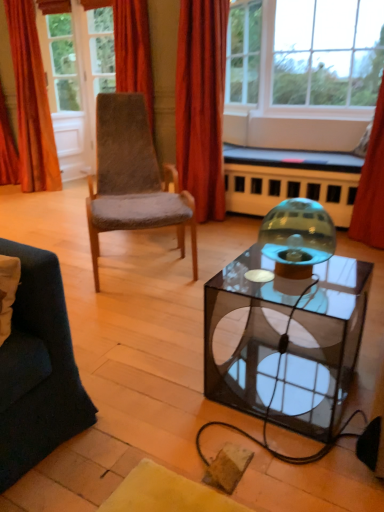
The height and width of the screenshot is (512, 384). Find the location of `empty space that is ontop of transparent glass table at center (from a real-world perspective)`. empty space that is ontop of transparent glass table at center (from a real-world perspective) is located at coordinates (281, 284).